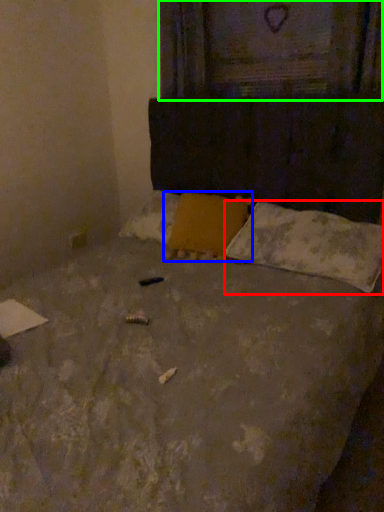
Question: Which is farther away from pillow (highlighted by a red box)? pillow (highlighted by a blue box) or window frame (highlighted by a green box)?

Choices:
 (A) pillow
 (B) window frame

Answer: (B)